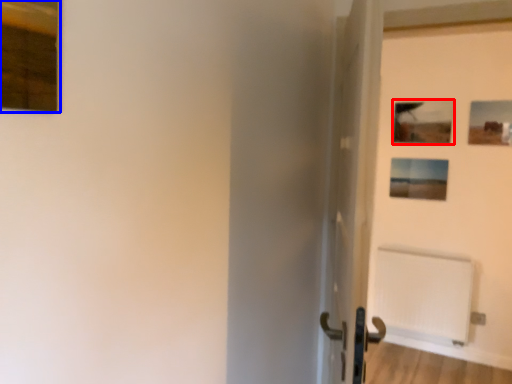
Question: Which object is further to the camera taking this photo, picture frame (highlighted by a red box) or picture frame (highlighted by a blue box)?

Choices:
 (A) picture frame
 (B) picture frame

Answer: (A)